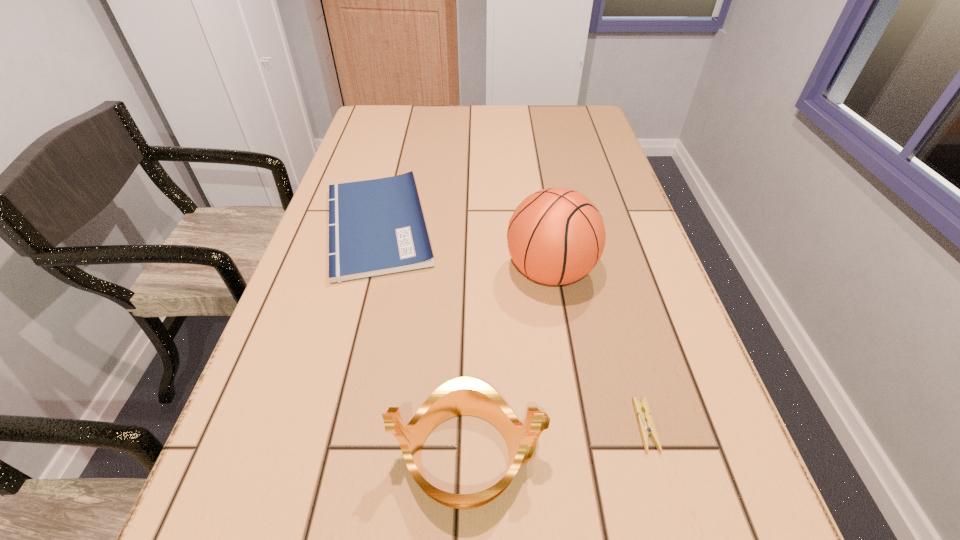
The image size is (960, 540). I want to click on basketball at the right edge, so pos(556,236).

Where is `clothespin situated at the right edge`? clothespin situated at the right edge is located at coordinates (647, 428).

Identify the location of vacant space at the far edge of the desktop. (545, 118).

The height and width of the screenshot is (540, 960). I want to click on vacant space at the left edge of the desktop, so click(310, 262).

The height and width of the screenshot is (540, 960). I want to click on blank space at the right edge of the desktop, so click(x=681, y=502).

Where is `vacant space at the far left corner`? This screenshot has height=540, width=960. vacant space at the far left corner is located at coordinates (393, 111).

Where is `vacant region at the far right corner of the desktop`? vacant region at the far right corner of the desktop is located at coordinates (555, 129).

Find the location of a particular element. free spot between the shortest object and the second tallest object is located at coordinates (557, 441).

You are a GUI agent. You are given a task and a screenshot of the screen. Output one action in this format:
    pyautogui.click(x=<x>, y=<y>)
    Task: Click on the free spot between the rightmost object and the third shortest object
    Image resolution: width=960 pixels, height=540 pixels.
    Given the screenshot: What is the action you would take?
    pyautogui.click(x=557, y=441)

Where is `unoccupied position between the paperback book and the basketball`? The height and width of the screenshot is (540, 960). unoccupied position between the paperback book and the basketball is located at coordinates (464, 249).